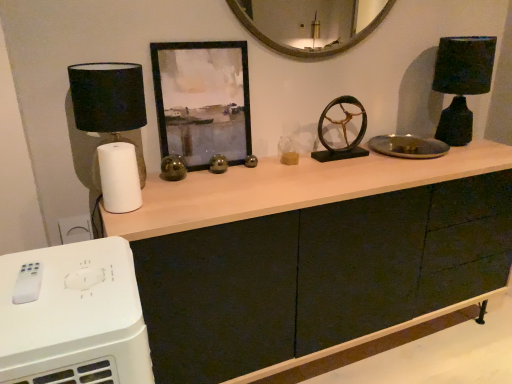
Question: Looking at the image, does matte black lampshade at left, positioned as the 2th table lamp in right-to-left order, seem bigger or smaller compared to matte black lampshade at right, arranged as the 2th table lamp when viewed from the left?

Choices:
 (A) big
 (B) small

Answer: (B)

Question: From the image's perspective, is matte black lampshade at left, which appears as the 1th table lamp when viewed from the front, positioned above or below matte black lampshade at right, positioned as the 1th table lamp in right-to-left order?

Choices:
 (A) below
 (B) above

Answer: (A)

Question: Which object is positioned closest to the black matte picture frame at center?

Choices:
 (A) matte black lampshade at left, positioned as the 2th table lamp in right-to-left order
 (B) bronze metallic wheel at center
 (C) white plastic remote control at lower left
 (D) matte black lampshade at right, positioned as the 1th table lamp in right-to-left order
 (E) matte black cabinet at center

Answer: (A)

Question: Which object is the closest to the bronze metallic wheel at center?

Choices:
 (A) white plastic remote control at lower left
 (B) matte black cabinet at center
 (C) matte black lampshade at left, which is counted as the 1th table lamp, starting from the left
 (D) matte black lampshade at right, arranged as the 2th table lamp when viewed from the left
 (E) black matte picture frame at center

Answer: (D)